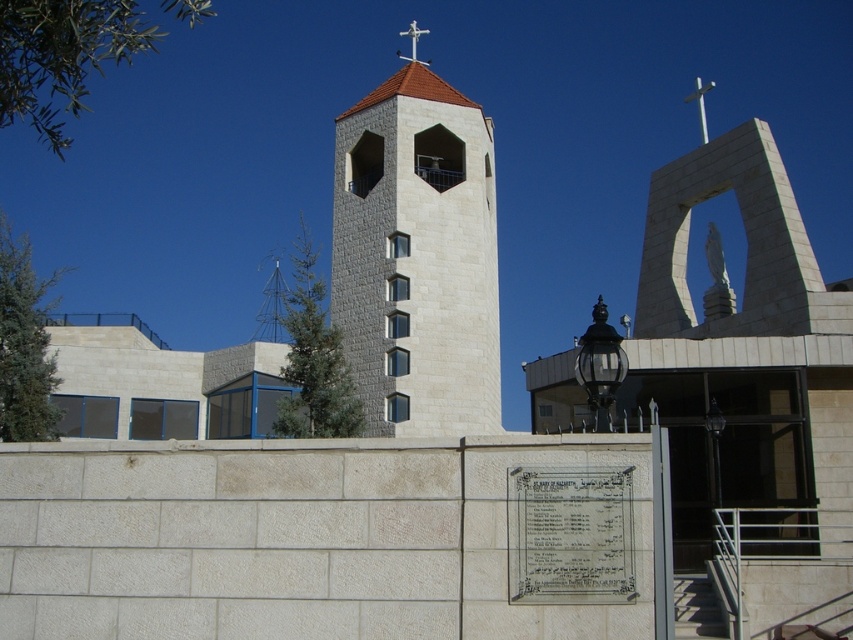
You are a visitor at the religious complex and want to take a photo of the beige stone bell tower at center and the white stone plaque at center. Which object should you place on the left side of your photo frame?

The beige stone bell tower at center should be placed on the left side of your photo frame because it is positioned on the left side of the white stone plaque at center.

Based on the photo, you are standing at the point marked by point [416,256] in the religious complex. What structure are you directly facing?

The point [416,256] marks the beige stone bell tower at center, so you are directly facing the beige stone bell tower at center.